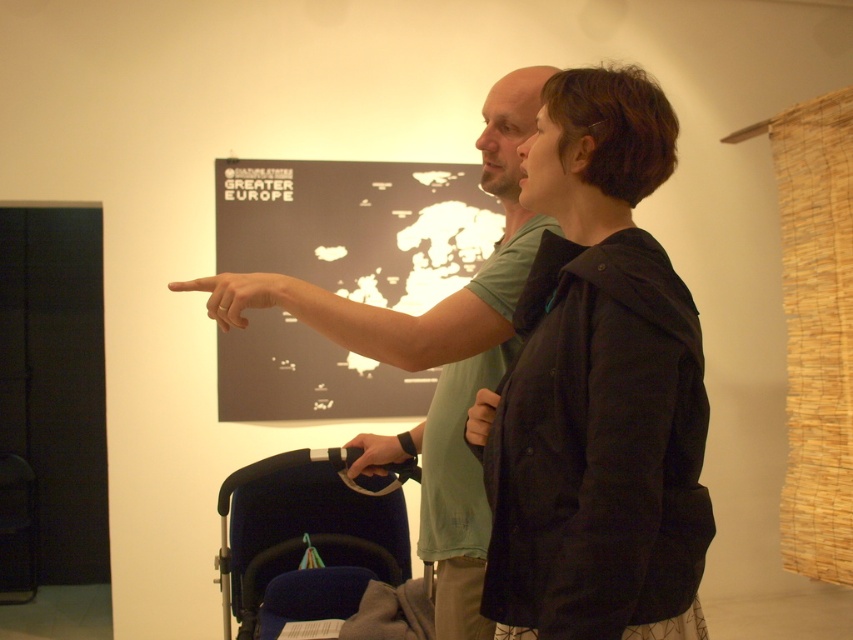
Question: Is green matte t-shirt at center below smooth skin finger at center?

Choices:
 (A) yes
 (B) no

Answer: (A)

Question: Among these points, which one is farthest from the camera?

Choices:
 (A) (305, 284)
 (B) (405, 456)
 (C) (299, 173)
 (D) (383, 556)

Answer: (C)

Question: Considering the real-world distances, which object is farthest from the matte black hand at center?

Choices:
 (A) green matte t-shirt at center
 (B) smooth skin finger at center

Answer: (B)

Question: Is matte black map at center above smooth skin finger at center?

Choices:
 (A) no
 (B) yes

Answer: (B)

Question: Is velvet blue baby carriage at lower left below matte black hand at center?

Choices:
 (A) no
 (B) yes

Answer: (B)

Question: Which point is farther to the camera?

Choices:
 (A) (482, 576)
 (B) (194, 288)
 (C) (372, 456)

Answer: (C)